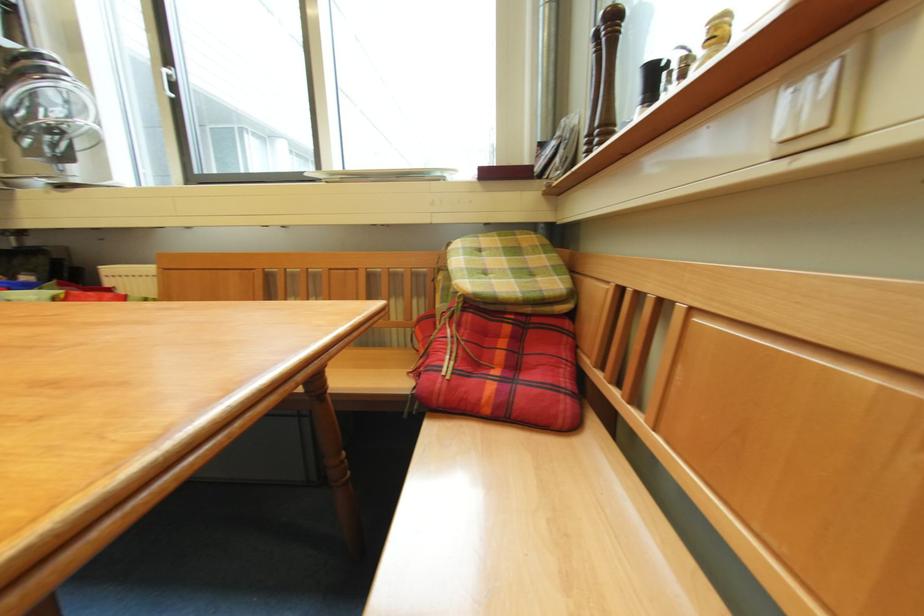
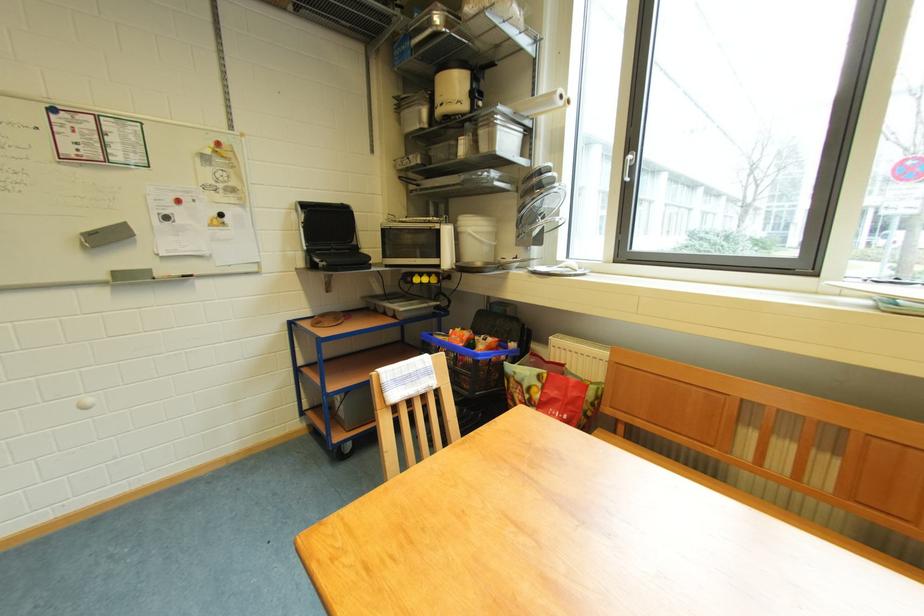
Where in the second image is the point corresponding to pixel 171 75 from the first image?

(634, 161)